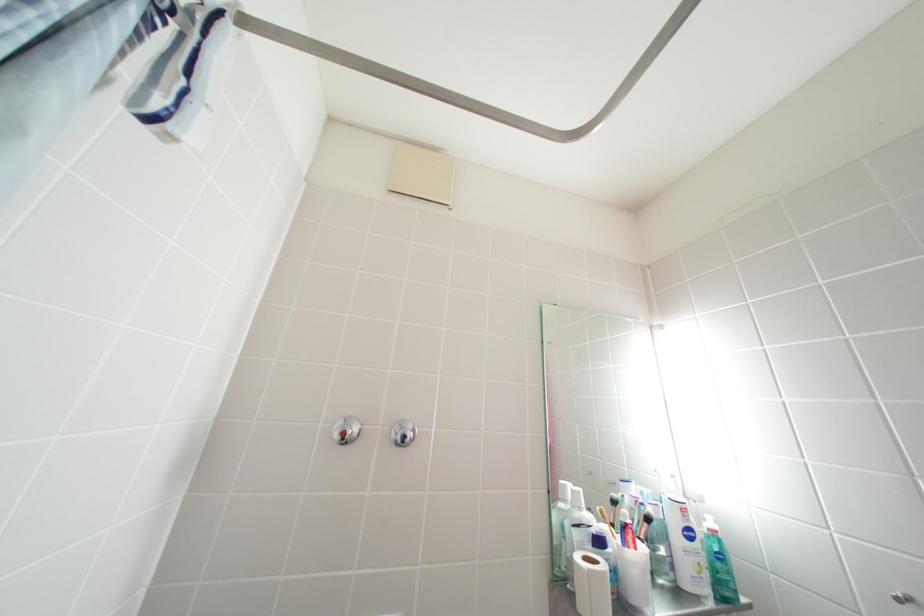
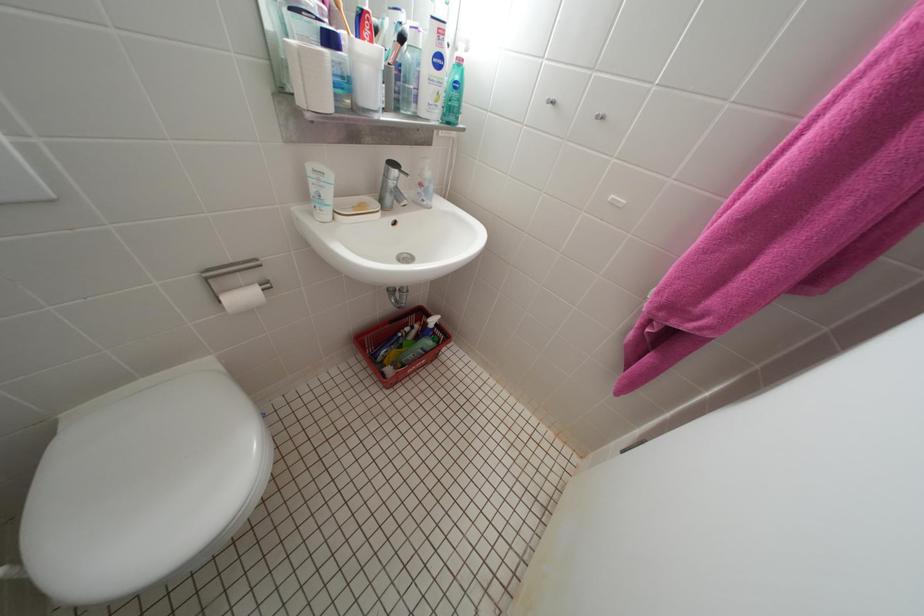
The first image is from the beginning of the video and the second image is from the end. How did the camera likely rotate when shooting the video?

The camera rotated toward right-down.